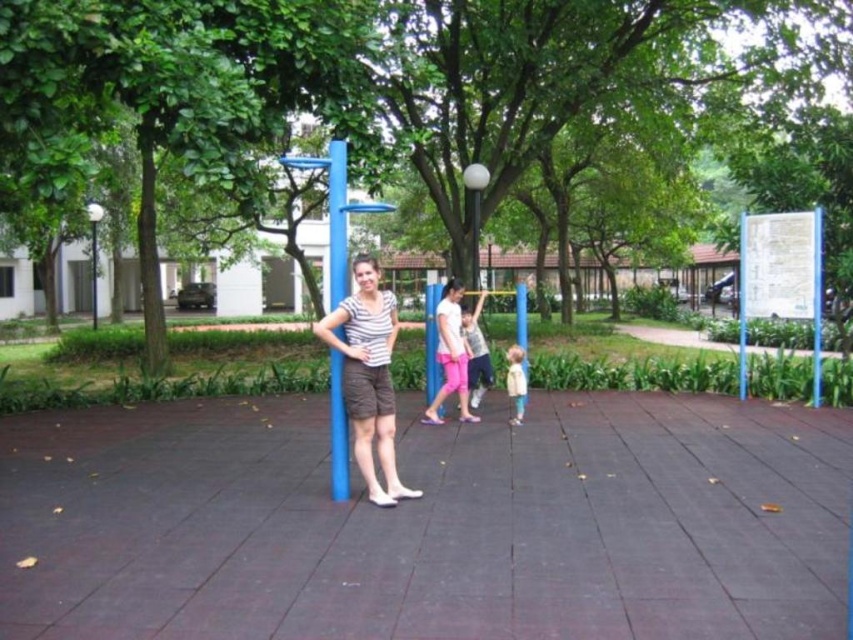
You are a delivery person who needs to place a small package between the pink fabric pants at center and the light beige fabric jacket at lower right. The package is 12 inches long. Can you fit it between them without moving either object?

The distance between the pink fabric pants at center and the light beige fabric jacket at lower right is 28.32 inches. Since the package is only 12 inches long, there is enough space to place it between them without moving either object.